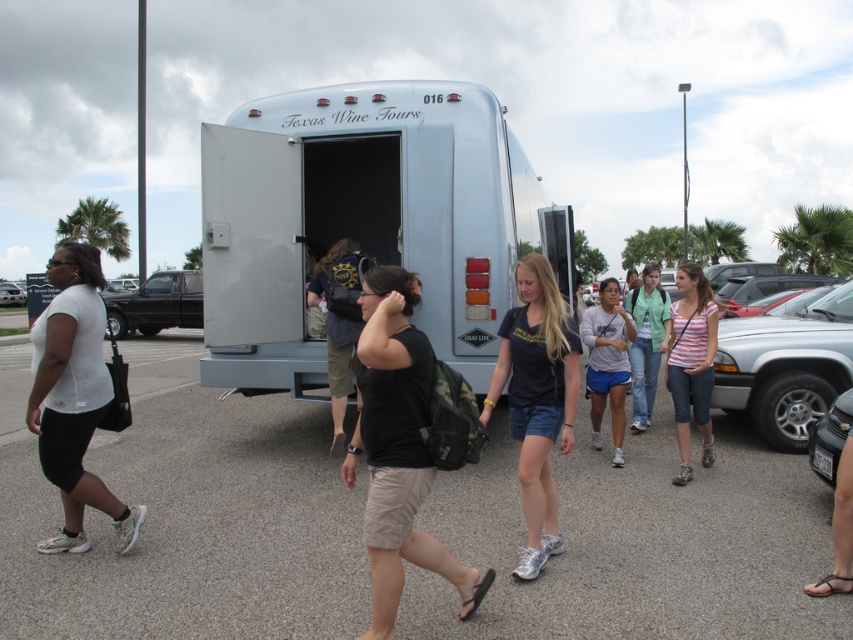
This screenshot has height=640, width=853. Identify the location of white matte shirt at left. (74, 397).

Is white matte shirt at left to the left of dark blue t-shirt at center from the viewer's perspective?

Indeed, white matte shirt at left is positioned on the left side of dark blue t-shirt at center.

Measure the distance between white matte shirt at left and camera.

white matte shirt at left and camera are 3.70 meters apart from each other.

Identify the location of white matte shirt at left. Image resolution: width=853 pixels, height=640 pixels. (74, 397).

Does dark blue t-shirt at center have a lesser height compared to striped cotton shirt at center?

No, dark blue t-shirt at center is not shorter than striped cotton shirt at center.

Between point (520, 435) and point (692, 266), which one is positioned behind?

Positioned behind is point (692, 266).

The width and height of the screenshot is (853, 640). Identify the location of dark blue t-shirt at center. (537, 400).

Is point (369, 284) more distant than point (820, 378)?

That is False.

Is point (413, 376) positioned before point (833, 310)?

Yes, it is.

This screenshot has height=640, width=853. Find the location of `black matte shirt at center`. black matte shirt at center is located at coordinates (397, 448).